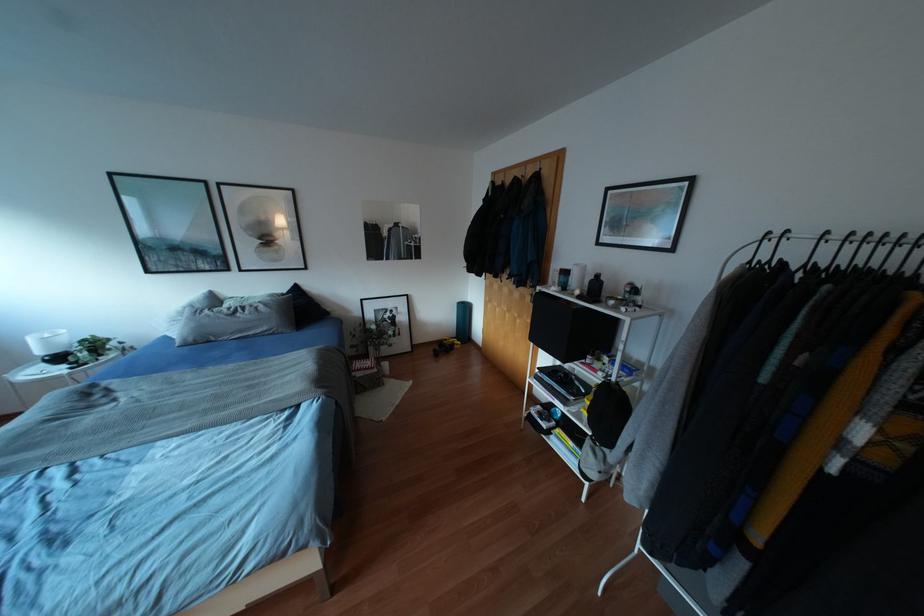
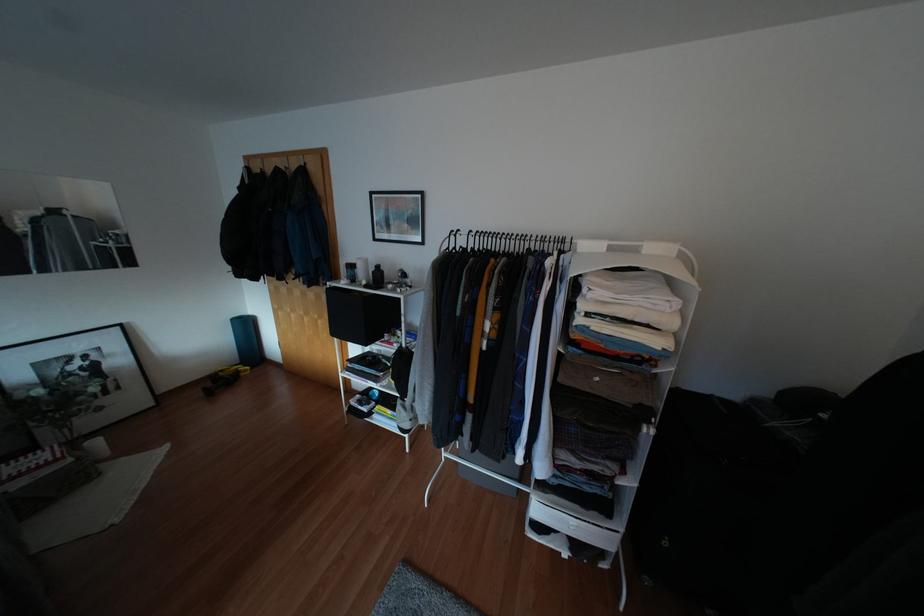
Locate, in the second image, the point that corresponds to point (465, 309) in the first image.

(246, 325)